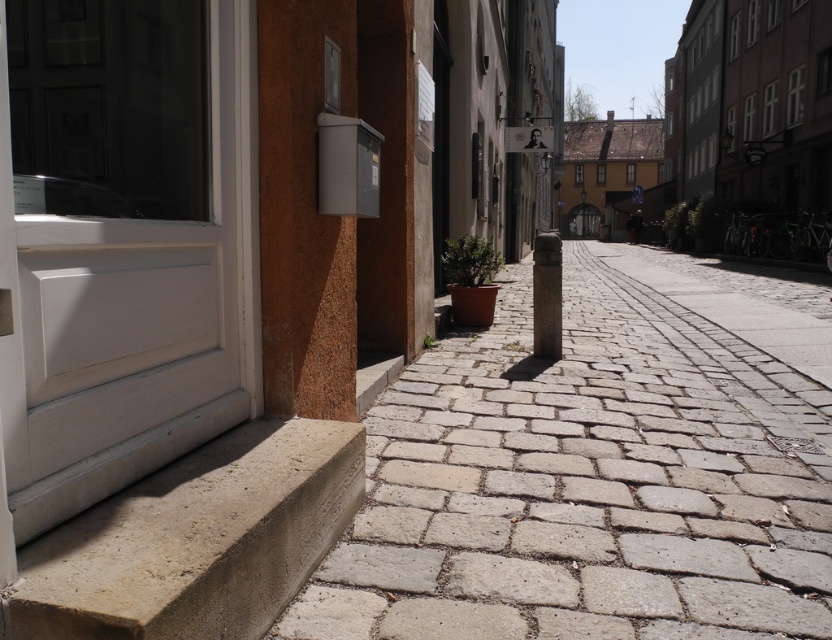
You are a delivery person trying to navigate to a doorstep. You see the gray stone pavement at lower center and the concrete step at lower left. Which one is closer to you?

The gray stone pavement at lower center is closer to you since the concrete step at lower left is behind it.